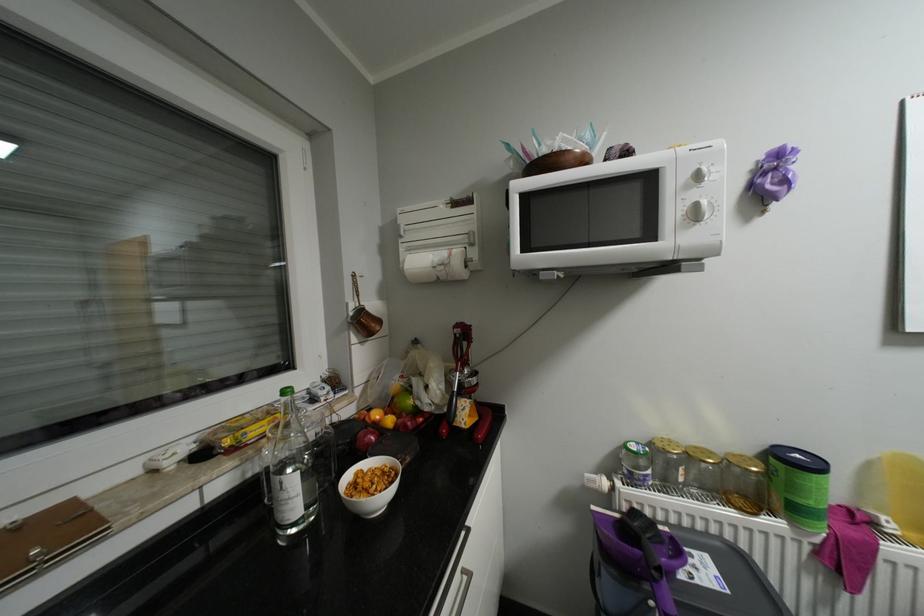
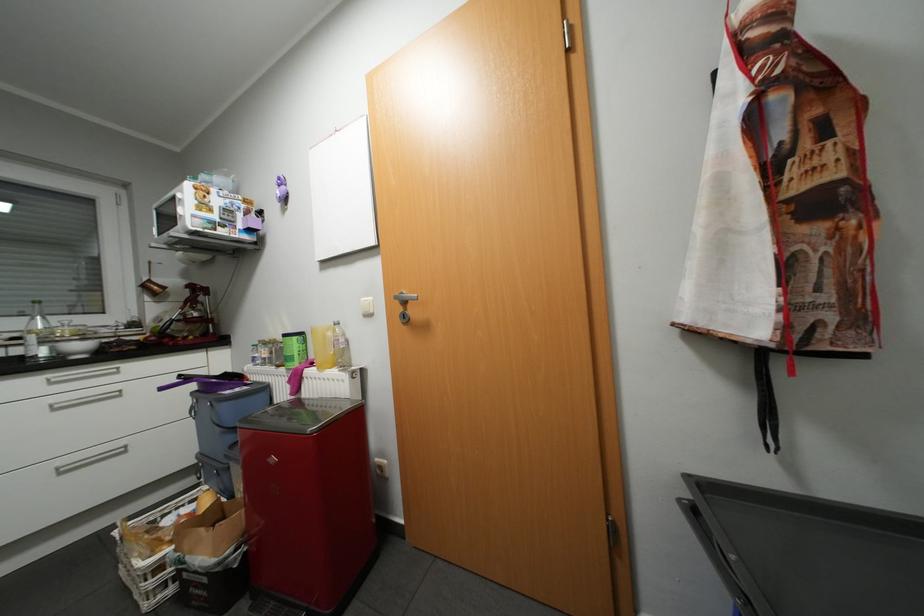
Question: The images are taken continuously from a first-person perspective. In which direction are you moving?

Choices:
 (A) Left
 (B) Right
 (C) Forward
 (D) Backward

Answer: (B)